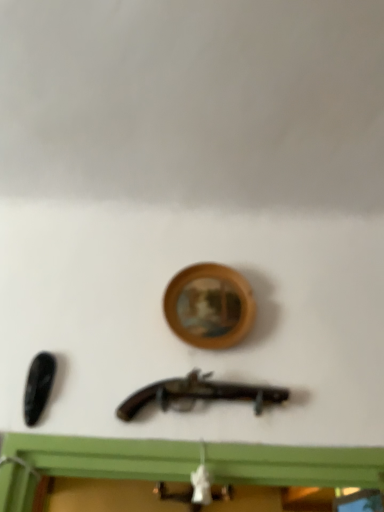
This screenshot has width=384, height=512. What do you see at coordinates (199, 394) in the screenshot?
I see `matte black revolver at center` at bounding box center [199, 394].

The height and width of the screenshot is (512, 384). What are the coordinates of `matte black revolver at center` in the screenshot? It's located at (199, 394).

Measure the distance between point (x=137, y=392) and camera.

Point (x=137, y=392) and camera are 3.44 feet apart.

The image size is (384, 512). In order to click on wooden picture frame at center in this screenshot , I will do `click(209, 306)`.

In order to face wooden picture frame at center, should I rotate leftwards or rightwards?

It's best to rotate right around 1.962 degrees.

The image size is (384, 512). What do you see at coordinates (209, 306) in the screenshot?
I see `wooden picture frame at center` at bounding box center [209, 306].

Locate an element on the screen. The image size is (384, 512). matte black revolver at center is located at coordinates (199, 394).

Considering the relative positions of matte black revolver at center and wooden picture frame at center in the image provided, is matte black revolver at center to the left of wooden picture frame at center from the viewer's perspective?

Correct, you'll find matte black revolver at center to the left of wooden picture frame at center.

Is the position of matte black revolver at center less distant than that of wooden picture frame at center?

Yes.

Is point (156, 388) closer to camera compared to point (198, 306)?

Yes, it is.

From the picture: From the image's perspective, is matte black revolver at center on top of wooden picture frame at center?

No, from the image's perspective, matte black revolver at center is not over wooden picture frame at center.

From a real-world perspective, relative to wooden picture frame at center, is matte black revolver at center vertically above or below?

matte black revolver at center is situated lower than wooden picture frame at center in the real world.

Which object is thinner, matte black revolver at center or wooden picture frame at center?

With smaller width is wooden picture frame at center.

Which of these two, matte black revolver at center or wooden picture frame at center, stands shorter?

matte black revolver at center is shorter.

In the scene shown: Considering the sizes of objects matte black revolver at center and wooden picture frame at center in the image provided, who is bigger, matte black revolver at center or wooden picture frame at center?

With larger size is wooden picture frame at center.

Is matte black revolver at center situated inside wooden picture frame at center or outside?

matte black revolver at center exists outside the volume of wooden picture frame at center.

Is the surface of matte black revolver at center in direct contact with wooden picture frame at center?

No, matte black revolver at center is not in contact with wooden picture frame at center.

Is wooden picture frame at center at the back of matte black revolver at center?

No, wooden picture frame at center is not at the back of matte black revolver at center.

How much distance is there between matte black revolver at center and wooden picture frame at center?

6.82 inches.

The image size is (384, 512). Identify the location of picture frame above the matte black revolver at center (from a real-world perspective). point(209,306).

Considering the positions of objects wooden picture frame at center and matte black revolver at center in the image provided, who is more to the left, wooden picture frame at center or matte black revolver at center?

From the viewer's perspective, matte black revolver at center appears more on the left side.

Which is behind, wooden picture frame at center or matte black revolver at center?

Positioned behind is wooden picture frame at center.

Between point (218, 264) and point (168, 383), which one is positioned behind?

The point (218, 264) is farther.

From the image's perspective, is wooden picture frame at center located beneath matte black revolver at center?

No, from the image's perspective, wooden picture frame at center is not beneath matte black revolver at center.

From a real-world perspective, who is located higher, wooden picture frame at center or matte black revolver at center?

wooden picture frame at center is physically above.

Does wooden picture frame at center have a greater width compared to matte black revolver at center?

No, wooden picture frame at center is not wider than matte black revolver at center.

Can you confirm if wooden picture frame at center is shorter than matte black revolver at center?

No.

Considering the sizes of objects wooden picture frame at center and matte black revolver at center in the image provided, who is bigger, wooden picture frame at center or matte black revolver at center?

With larger size is wooden picture frame at center.

Is wooden picture frame at center inside or outside of matte black revolver at center?

wooden picture frame at center is outside matte black revolver at center.

Would you consider wooden picture frame at center to be distant from matte black revolver at center?

No.

Is wooden picture frame at center facing towards matte black revolver at center?

No, wooden picture frame at center does not turn towards matte black revolver at center.

In the scene shown: What's the angular difference between wooden picture frame at center and matte black revolver at center's facing directions?

The facing directions of wooden picture frame at center and matte black revolver at center are 3.5 degrees apart.

You are a GUI agent. You are given a task and a screenshot of the screen. Output one action in this format:
    pyautogui.click(x=<x>, y=<y>)
    Task: Click on the picture frame on the right of matte black revolver at center
    Image resolution: width=384 pixels, height=512 pixels.
    Given the screenshot: What is the action you would take?
    pyautogui.click(x=209, y=306)

The height and width of the screenshot is (512, 384). In order to click on picture frame above the matte black revolver at center (from the image's perspective) in this screenshot , I will do `click(209, 306)`.

This screenshot has height=512, width=384. Find the location of `picture frame on the right of matte black revolver at center`. picture frame on the right of matte black revolver at center is located at coordinates tap(209, 306).